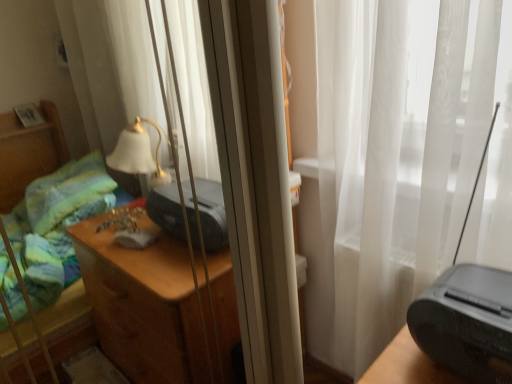
Locate an element on the screen. Image resolution: width=512 pixels, height=384 pixels. vacant space situated above black plastic printer at right, which is the 1th printer from right to left (from a real-world perspective) is located at coordinates (474, 292).